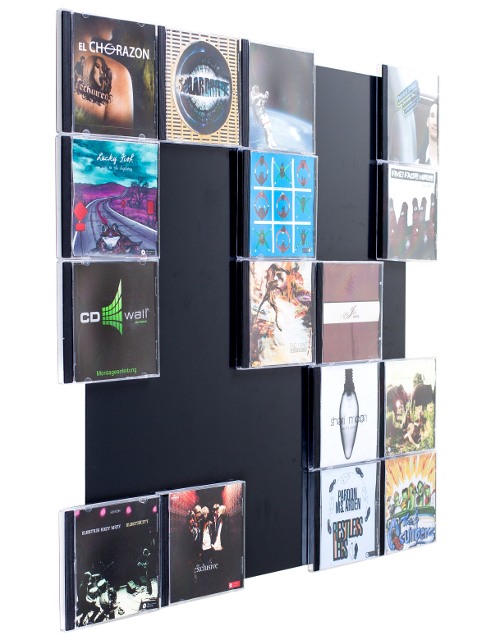
At what (x,y) coordinates should I click in order to perform the action: click on black board. Please return your answer as a coordinate pair (x, y). Looking at the image, I should click on (346, 107), (208, 313), (281, 441), (281, 534).